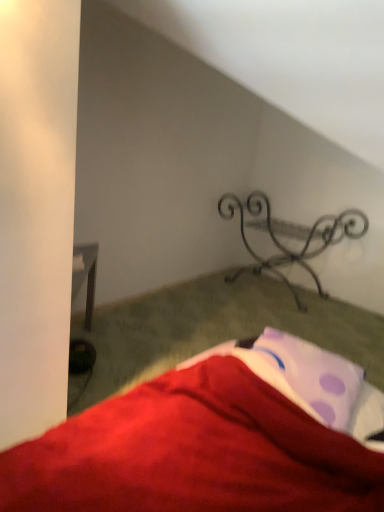
Identify the location of metallic wrought iron bench at center. (289, 237).

From the picture: What is the approximate height of metallic wrought iron bench at center?

It is 65.64 centimeters.

The image size is (384, 512). What do you see at coordinates (289, 237) in the screenshot? I see `metallic wrought iron bench at center` at bounding box center [289, 237].

Identify the location of purple dotted fabric at lower right. (311, 382).

This screenshot has width=384, height=512. What do you see at coordinates (311, 382) in the screenshot? I see `purple dotted fabric at lower right` at bounding box center [311, 382].

Find the location of a particular element. This screenshot has width=384, height=512. metallic wrought iron bench at center is located at coordinates (289, 237).

In the image, is purple dotted fabric at lower right on the left side or the right side of metallic wrought iron bench at center?

From the image, it's evident that purple dotted fabric at lower right is to the left of metallic wrought iron bench at center.

Based on the photo, is purple dotted fabric at lower right in front of metallic wrought iron bench at center?

Yes, the depth of purple dotted fabric at lower right is less than that of metallic wrought iron bench at center.

Is point (332, 396) positioned behind point (250, 193)?

No, (332, 396) is in front of (250, 193).

From the image's perspective, is purple dotted fabric at lower right below metallic wrought iron bench at center?

Yes.

From a real-world perspective, who is located lower, purple dotted fabric at lower right or metallic wrought iron bench at center?

In real-world perspective, metallic wrought iron bench at center is lower.

Considering the relative sizes of purple dotted fabric at lower right and metallic wrought iron bench at center in the image provided, is purple dotted fabric at lower right thinner than metallic wrought iron bench at center?

Correct, the width of purple dotted fabric at lower right is less than that of metallic wrought iron bench at center.

Does purple dotted fabric at lower right have a lesser height compared to metallic wrought iron bench at center?

Yes.

Does purple dotted fabric at lower right have a larger size compared to metallic wrought iron bench at center?

Incorrect, purple dotted fabric at lower right is not larger than metallic wrought iron bench at center.

Is metallic wrought iron bench at center surrounded by purple dotted fabric at lower right?

Actually, metallic wrought iron bench at center is outside purple dotted fabric at lower right.

Is purple dotted fabric at lower right positioned far away from metallic wrought iron bench at center?

Yes, purple dotted fabric at lower right is far from metallic wrought iron bench at center.

Is purple dotted fabric at lower right positioned with its back to metallic wrought iron bench at center?

That's not correct — purple dotted fabric at lower right is not looking away from metallic wrought iron bench at center.

Can you tell me how much purple dotted fabric at lower right and metallic wrought iron bench at center differ in facing direction?

88.9 degrees separate the facing orientations of purple dotted fabric at lower right and metallic wrought iron bench at center.

Image resolution: width=384 pixels, height=512 pixels. What are the coordinates of `sheet above the metallic wrought iron bench at center (from a real-world perspective)` in the screenshot? It's located at (311, 382).

Between metallic wrought iron bench at center and purple dotted fabric at lower right, which one appears on the left side from the viewer's perspective?

purple dotted fabric at lower right.

Between metallic wrought iron bench at center and purple dotted fabric at lower right, which one is positioned behind?

metallic wrought iron bench at center is further away from the camera.

Between point (348, 233) and point (288, 360), which one is positioned behind?

The point (348, 233) is more distant.

From the image's perspective, who appears lower, metallic wrought iron bench at center or purple dotted fabric at lower right?

purple dotted fabric at lower right, from the image's perspective.

In the scene shown: From a real-world perspective, is metallic wrought iron bench at center physically located above or below purple dotted fabric at lower right?

Clearly, from a real-world perspective, metallic wrought iron bench at center is below purple dotted fabric at lower right.

Which object is thinner, metallic wrought iron bench at center or purple dotted fabric at lower right?

With smaller width is purple dotted fabric at lower right.

Does metallic wrought iron bench at center have a lesser height compared to purple dotted fabric at lower right?

No, metallic wrought iron bench at center is not shorter than purple dotted fabric at lower right.

Based on the photo, based on their sizes in the image, would you say metallic wrought iron bench at center is bigger or smaller than purple dotted fabric at lower right?

metallic wrought iron bench at center is bigger than purple dotted fabric at lower right.

Is purple dotted fabric at lower right inside metallic wrought iron bench at center?

No, metallic wrought iron bench at center does not contain purple dotted fabric at lower right.

Would you say metallic wrought iron bench at center is a long distance from purple dotted fabric at lower right?

Yes, metallic wrought iron bench at center is far from purple dotted fabric at lower right.

Does metallic wrought iron bench at center turn towards purple dotted fabric at lower right?

Yes, metallic wrought iron bench at center is oriented towards purple dotted fabric at lower right.

How many degrees apart are the facing directions of metallic wrought iron bench at center and purple dotted fabric at lower right?

88.9 degrees.

Locate an element on the screen. The image size is (384, 512). furniture located underneath the purple dotted fabric at lower right (from a real-world perspective) is located at coordinates (289, 237).

What are the coordinates of `furniture to the right of purple dotted fabric at lower right` in the screenshot? It's located at (289, 237).

Image resolution: width=384 pixels, height=512 pixels. What are the coordinates of `furniture lying behind the purple dotted fabric at lower right` in the screenshot? It's located at (289, 237).